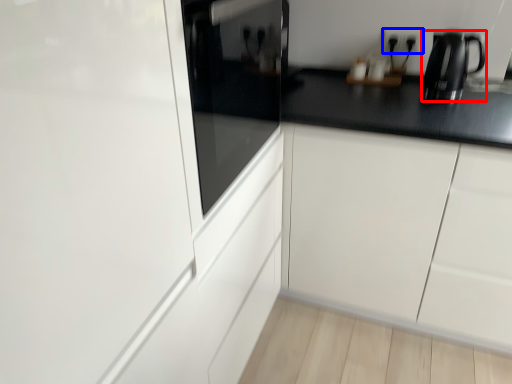
Question: Which object appears closest to the camera in this image, kitchen appliance (highlighted by a red box) or electric outlet (highlighted by a blue box)?

Choices:
 (A) kitchen appliance
 (B) electric outlet

Answer: (A)